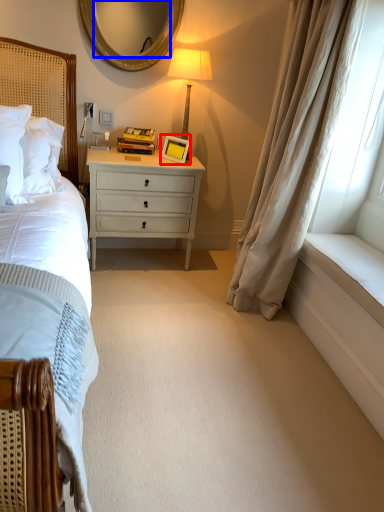
Question: Among these objects, which one is nearest to the camera, picture frame (highlighted by a red box) or mirror (highlighted by a blue box)?

Choices:
 (A) picture frame
 (B) mirror

Answer: (B)